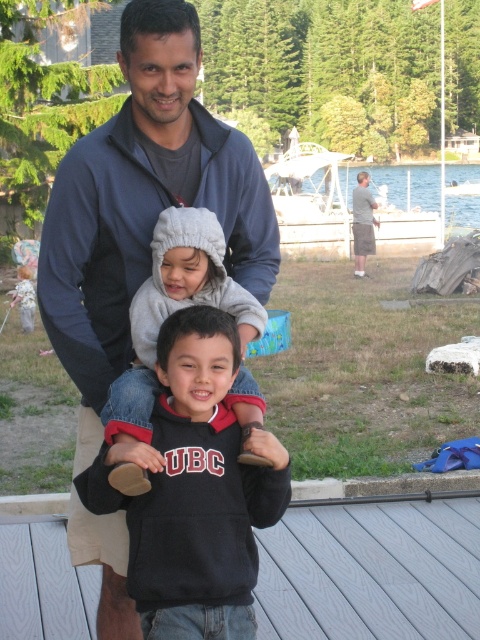
You are standing on the gray wood deck at center and want to hand a snack to someone wearing gray cotton shorts at right. Can you reach them without moving from your current position?

The gray wood deck at center and gray cotton shorts at right are 12.74 meters apart, so you cannot reach them without moving from your current position.

Looking at this image, in the scene, there are two children wearing a black fleece sweatshirt at center and a gray fleece hoodie at center. Which child is wearing a larger clothing item?

The black fleece sweatshirt at center is wider than the gray fleece hoodie at center, so the child wearing the black fleece sweatshirt at center has the larger clothing item.